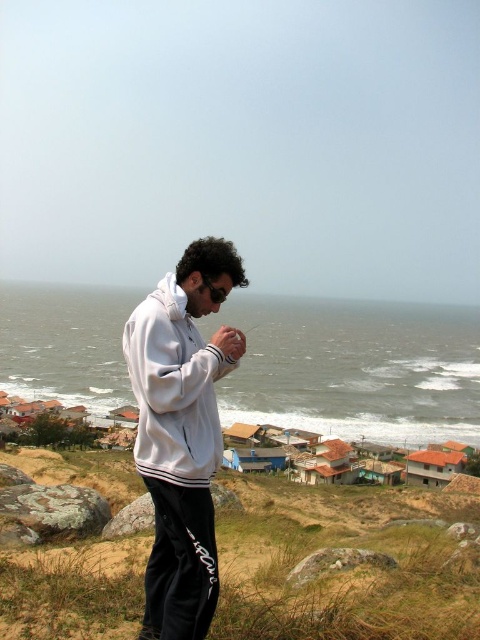
You are a photographer trying to capture the person on the hill while ensuring both the white matte jacket at center and the white fleece sweatshirt at center are visible in the frame. Which clothing item should you focus on to include both in the photo?

The white matte jacket at center is taller than the white fleece sweatshirt at center. To include both in the photo, focus on the white matte jacket at center as it is taller and will likely be more prominent in the frame.